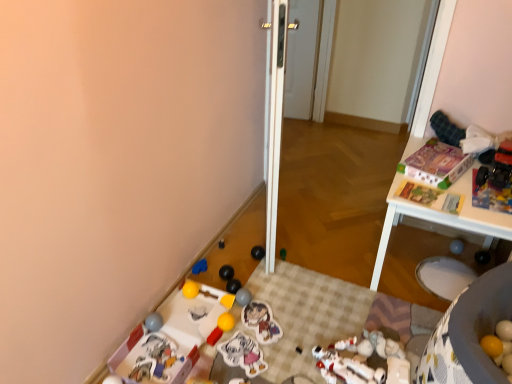
Locate an element on the screen. The image size is (512, 384). free location to the right of matte plastic sticker at center, placed as the ninth toy when sorted from right to left is located at coordinates (287, 353).